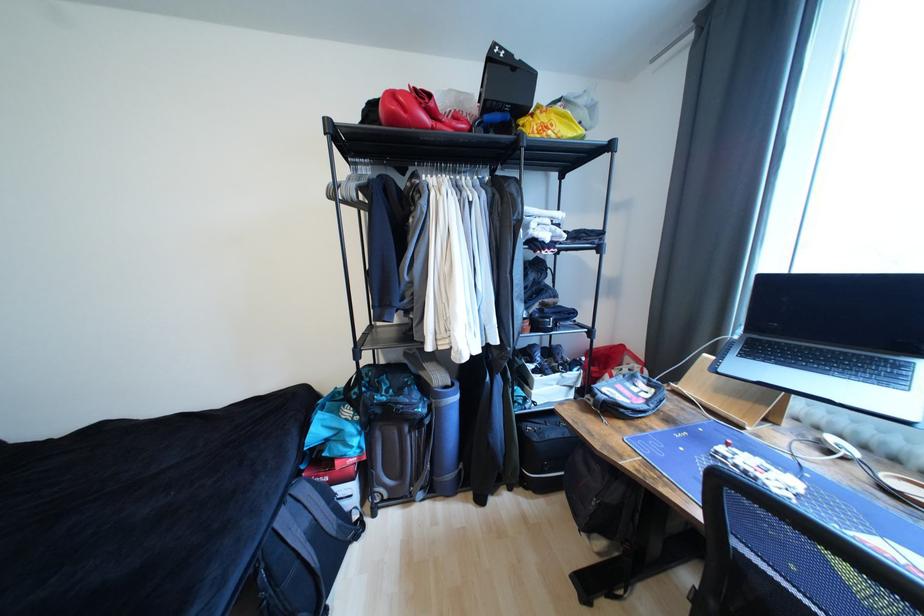
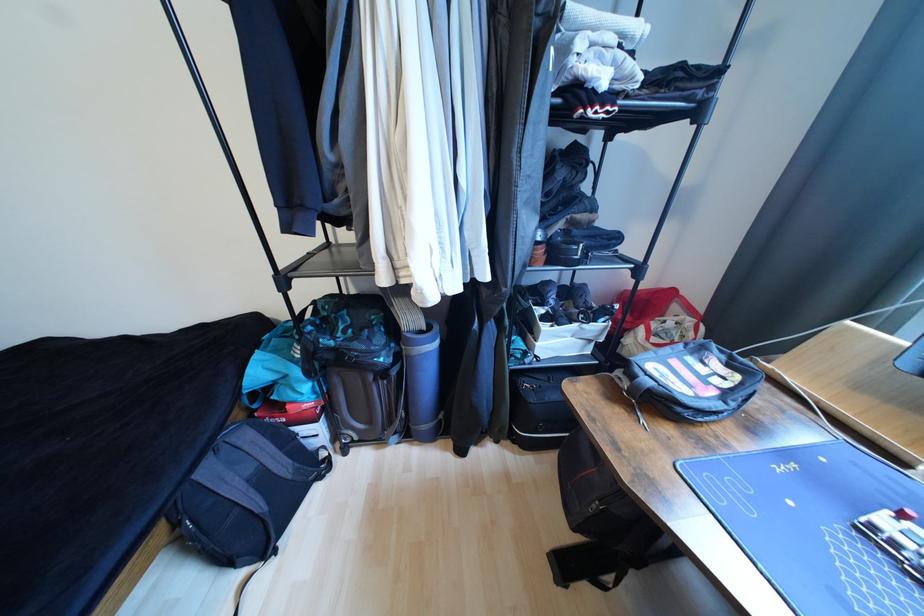
Find the pixel in the second image that matches point 289,520 in the first image.

(215, 472)